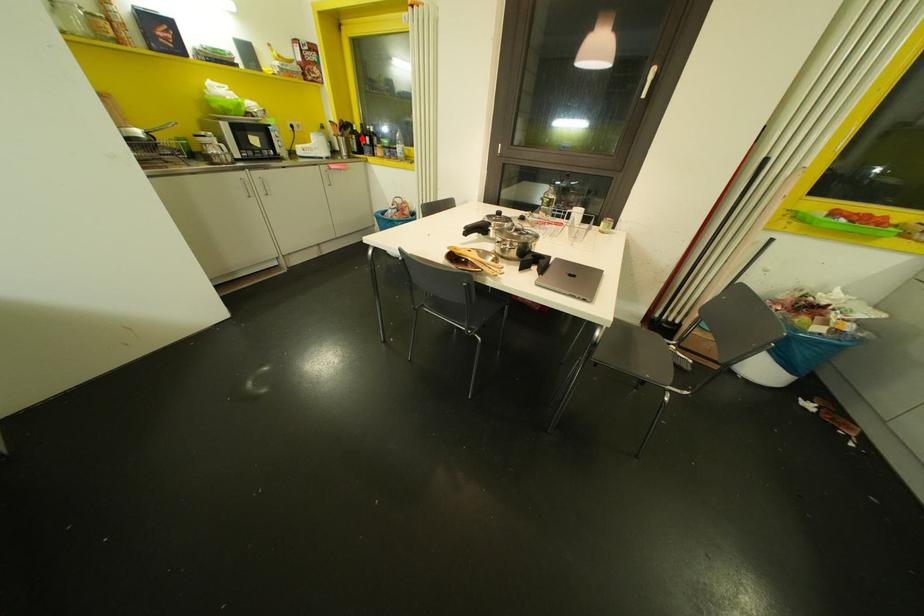
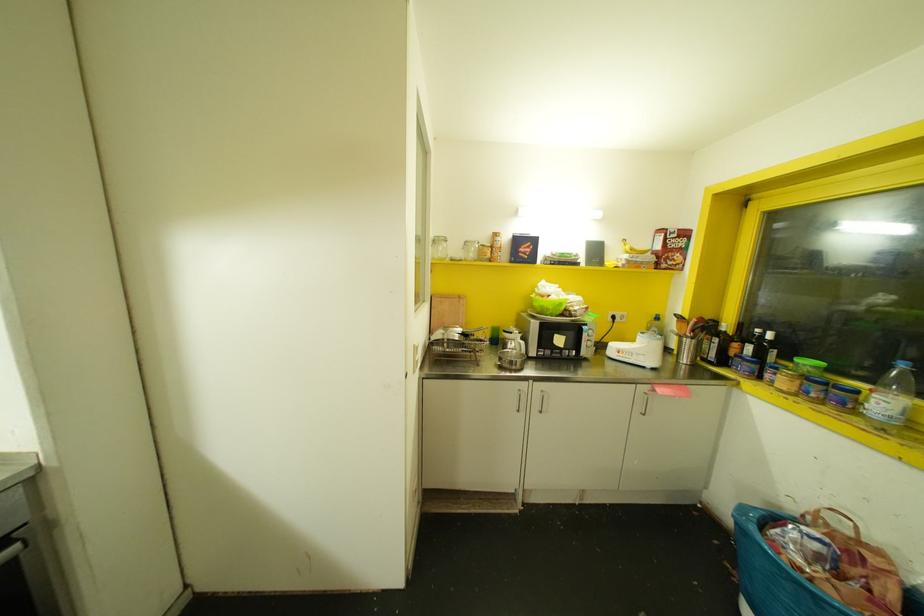
In the second image, find the point that corresponds to the highlighted location in the first image.

(735, 345)